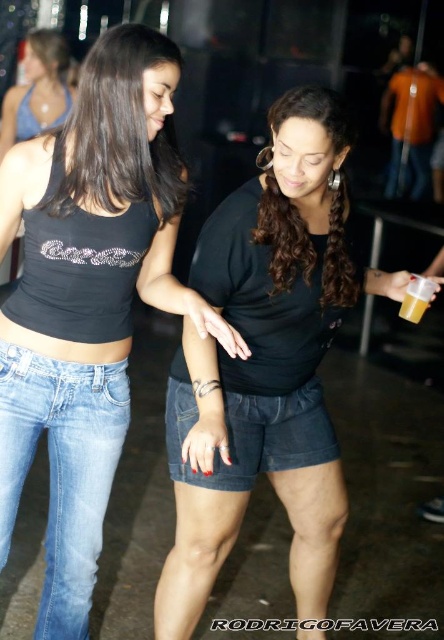
Between black matte tank top at upper left and matte blue tank top at upper left, which one has less height?

Standing shorter between the two is matte blue tank top at upper left.

Does black matte tank top at upper left have a larger size compared to matte blue tank top at upper left?

Indeed, black matte tank top at upper left has a larger size compared to matte blue tank top at upper left.

Does point (145, 240) come closer to viewer compared to point (38, 80)?

Yes, point (145, 240) is closer to viewer.

Where is `black matte tank top at upper left`? The height and width of the screenshot is (640, 444). black matte tank top at upper left is located at coordinates (87, 298).

Does black matte tank top at upper left have a lesser width compared to denim shorts at center?

In fact, black matte tank top at upper left might be wider than denim shorts at center.

Can you confirm if black matte tank top at upper left is smaller than denim shorts at center?

No.

Where is `black matte tank top at upper left`? This screenshot has height=640, width=444. black matte tank top at upper left is located at coordinates (87, 298).

Can you confirm if black matte shorts at center is thinner than denim shorts at center?

No, black matte shorts at center is not thinner than denim shorts at center.

Who is more forward, (181, 552) or (171, 426)?

Point (181, 552) is more forward.

At what (x,y) coordinates should I click in order to perform the action: click on black matte shorts at center. Please return your answer as a coordinate pair (x, y). Image resolution: width=444 pixels, height=640 pixels. Looking at the image, I should click on (264, 362).